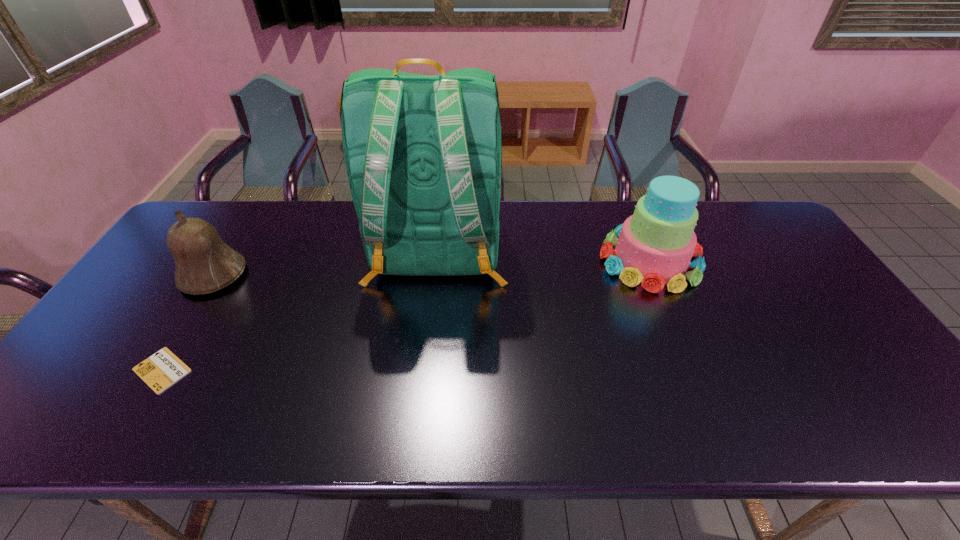
Where is `backpack that is at the far edge`? backpack that is at the far edge is located at coordinates (423, 154).

This screenshot has width=960, height=540. What are the coordinates of `cake present at the far edge` in the screenshot? It's located at (655, 246).

Where is `bell at the left edge`? bell at the left edge is located at coordinates (203, 262).

Where is `identity card present at the left edge`? identity card present at the left edge is located at coordinates (161, 370).

Where is `vacant space at the far edge of the desktop`? This screenshot has width=960, height=540. vacant space at the far edge of the desktop is located at coordinates (262, 213).

The height and width of the screenshot is (540, 960). In order to click on free spot at the near edge of the desktop in this screenshot , I will do `click(274, 436)`.

This screenshot has width=960, height=540. I want to click on vacant space at the right edge, so click(777, 289).

The height and width of the screenshot is (540, 960). Identify the location of blank space at the far right corner of the desktop. (724, 213).

This screenshot has width=960, height=540. What are the coordinates of `vacant space at the near right corner` in the screenshot? It's located at (859, 419).

Locate an element on the screen. This screenshot has width=960, height=540. vacant area that lies between the cake and the identity card is located at coordinates (406, 315).